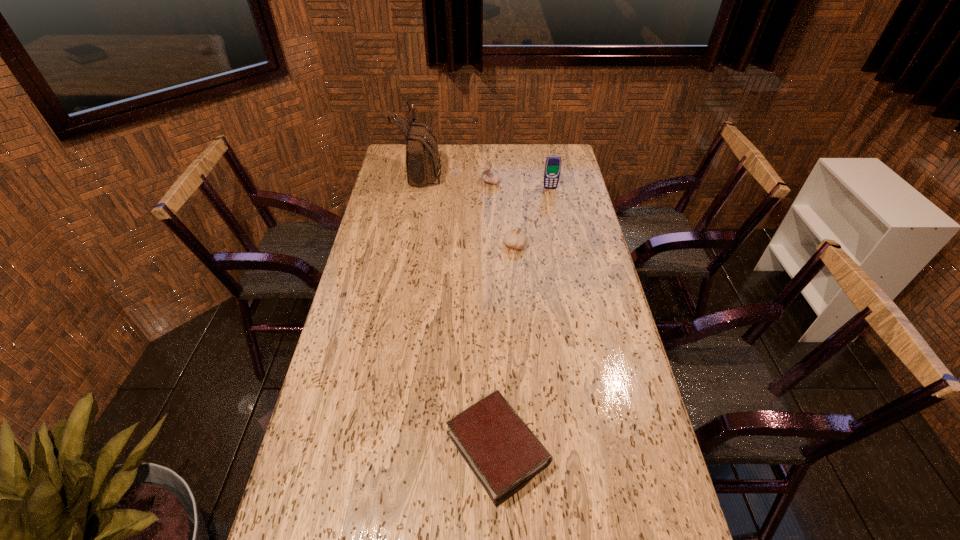
Find the location of a particular element. the tallest object is located at coordinates (422, 156).

The height and width of the screenshot is (540, 960). Identify the location of shoulder bag. (422, 156).

You are a GUI agent. You are given a task and a screenshot of the screen. Output one action in this format:
    pyautogui.click(x=<x>, y=<y>)
    Task: Click on the rightmost object
    The image size is (960, 540).
    Given the screenshot: What is the action you would take?
    pyautogui.click(x=552, y=170)

The image size is (960, 540). I want to click on the second tallest object, so click(552, 170).

You are a GUI agent. You are given a task and a screenshot of the screen. Output one action in this format:
    pyautogui.click(x=<x>, y=<y>)
    Task: Click on the farther garlic
    
    Given the screenshot: What is the action you would take?
    pyautogui.click(x=491, y=176)

Find the location of a particular element. the third tallest object is located at coordinates (491, 176).

At what (x,y) coordinates should I click in order to perform the action: click on the second shortest object. Please return your answer as a coordinate pair (x, y). Looking at the image, I should click on (515, 238).

Where is `the fourth farthest object`? The width and height of the screenshot is (960, 540). the fourth farthest object is located at coordinates (515, 238).

This screenshot has width=960, height=540. I want to click on the nearest object, so click(503, 453).

The height and width of the screenshot is (540, 960). In order to click on Bible in this screenshot , I will do `click(503, 453)`.